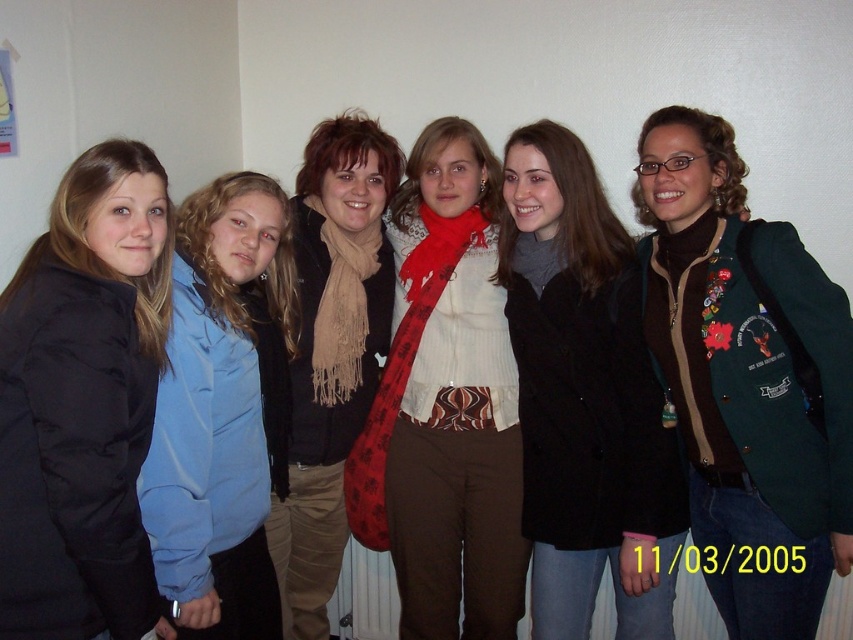
Is beige scarf at center wider than red plaid scarf at center?

In fact, beige scarf at center might be narrower than red plaid scarf at center.

Identify the location of beige scarf at center. (331, 353).

Can you confirm if matte black coat at center is thinner than black puffy jacket at left?

In fact, matte black coat at center might be wider than black puffy jacket at left.

Who is positioned more to the right, matte black coat at center or black puffy jacket at left?

matte black coat at center is more to the right.

The width and height of the screenshot is (853, 640). In order to click on matte black coat at center in this screenshot , I will do `click(584, 397)`.

Can you confirm if black puffy jacket at left is taller than blue fabric shirt at left?

No, black puffy jacket at left is not taller than blue fabric shirt at left.

Is point (144, 426) behind point (183, 568)?

No, (144, 426) is closer to viewer.

Where is `black puffy jacket at left`? This screenshot has height=640, width=853. black puffy jacket at left is located at coordinates (80, 413).

Image resolution: width=853 pixels, height=640 pixels. I want to click on black puffy jacket at left, so click(80, 413).